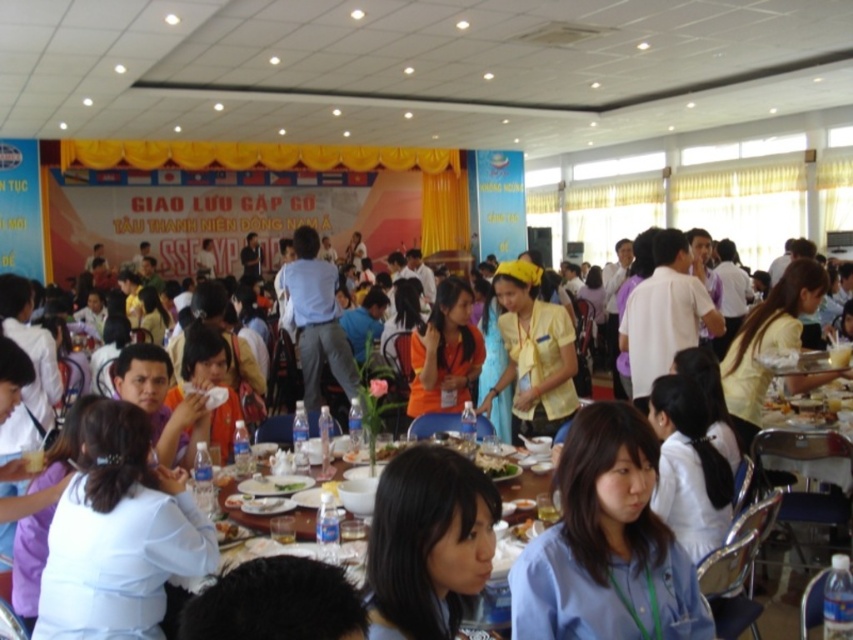
Question: Can you confirm if white glossy table at center is positioned above green leafy vegetable at center?

Choices:
 (A) yes
 (B) no

Answer: (B)

Question: Which point is closer to the camera taking this photo?

Choices:
 (A) (305, 484)
 (B) (263, 515)
 (C) (486, 474)

Answer: (C)

Question: Is white glossy plate at center thinner than green leafy vegetable at center?

Choices:
 (A) no
 (B) yes

Answer: (A)

Question: Which of the following is the closest to the observer?

Choices:
 (A) (517, 472)
 (B) (527, 474)
 (C) (312, 481)

Answer: (A)

Question: From the image, what is the correct spatial relationship of white glossy plate at center in relation to green leafy vegetable at center?

Choices:
 (A) above
 (B) below

Answer: (A)

Question: Among these objects, which one is farthest from the camera?

Choices:
 (A) white glossy plate at center
 (B) white glossy table at center

Answer: (A)